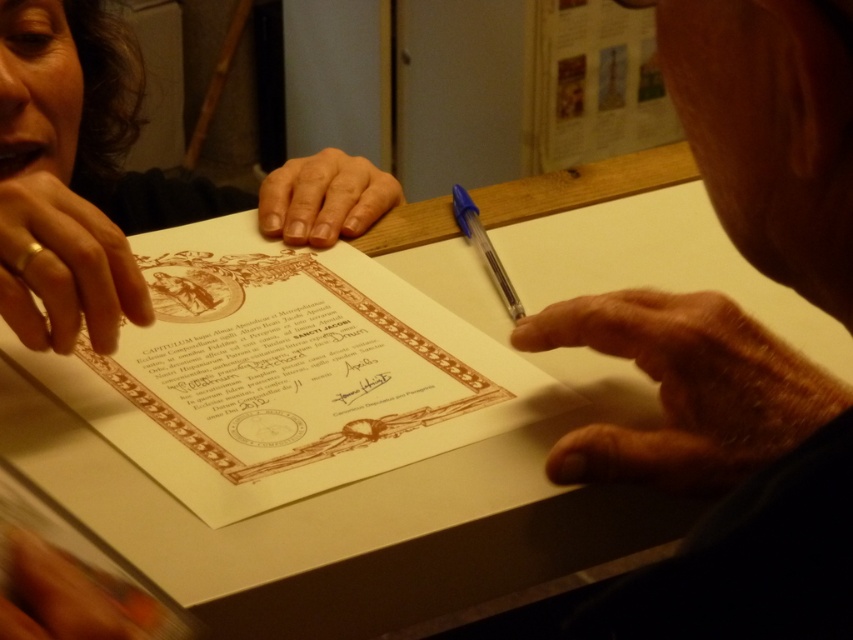
You are a historian analyzing the image. You need to determine the spatial relationship between the brown paper document at center and the dry skin at center. Based on the scene, which object is positioned to the left?

The brown paper document at center is to the left of dry skin at center.

You are a detective analyzing the scene. You notice the gold ring at left and the smooth skin hand at center. Which object is closer to the left edge of the image?

The gold ring at left is closer to the left edge of the image because it is positioned on the left side of the smooth skin hand at center.